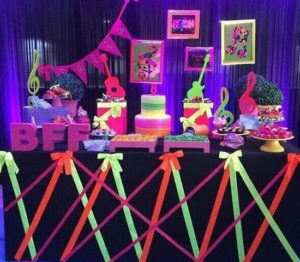
Where is `ribbon`? The image size is (300, 262). ribbon is located at coordinates (108, 156).